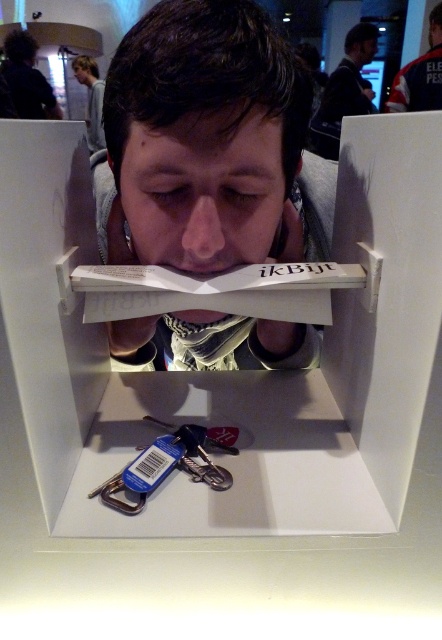
Question: Which point appears closest to the camera in this image?

Choices:
 (A) (7, 80)
 (B) (316, 150)
 (C) (410, 100)
 (D) (185, 426)

Answer: (D)

Question: Which point is closer to the camera?

Choices:
 (A) (189, 161)
 (B) (402, 92)
 (C) (339, 120)

Answer: (A)

Question: Does white fabric shirt at upper center have a lesser width compared to gray fabric shirt at upper center?

Choices:
 (A) no
 (B) yes

Answer: (A)

Question: Based on their relative distances, which object is farther from the dark brown leather jacket at upper center?

Choices:
 (A) gray fabric shirt at upper center
 (B) dark curly hair at upper left

Answer: (B)

Question: Considering the relative positions of matte black book at center and dark curly hair at upper left in the image provided, where is matte black book at center located with respect to dark curly hair at upper left?

Choices:
 (A) right
 (B) left

Answer: (A)

Question: Does metallic key at lower center appear on the right side of white fabric shirt at upper center?

Choices:
 (A) no
 (B) yes

Answer: (A)